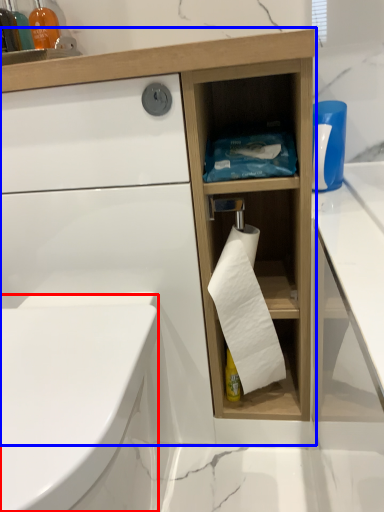
Question: Among these objects, which one is nearest to the camera, bidet (highlighted by a red box) or bathroom cabinet (highlighted by a blue box)?

Choices:
 (A) bidet
 (B) bathroom cabinet

Answer: (A)